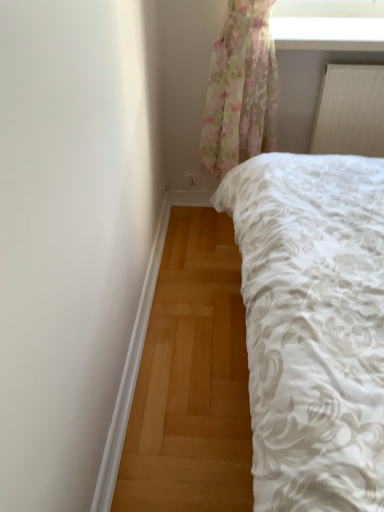
I want to click on vacant point above transparent floral curtain at upper center (from a real-world perspective), so click(322, 23).